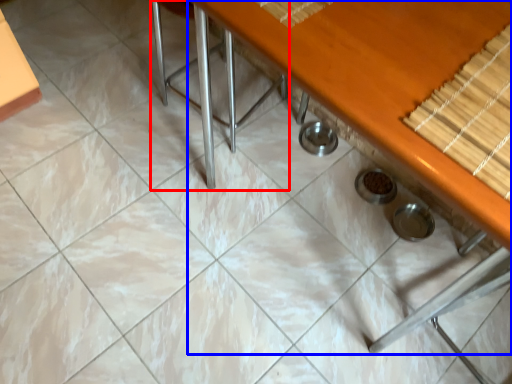
Question: Among these objects, which one is farthest to the camera, chair (highlighted by a red box) or table (highlighted by a blue box)?

Choices:
 (A) chair
 (B) table

Answer: (A)